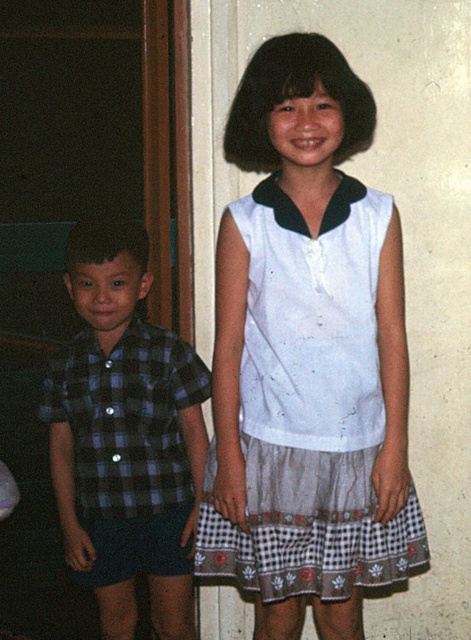
You are a photographer setting up for a photoshoot in the described scene. You need to position a spotlight to the left of the checkered fabric shirt at left. Will the spotlight interfere with the white cotton dress at upper center?

The white cotton dress at upper center is to the right of the checkered fabric shirt at left, so placing the spotlight to the left of the checkered fabric shirt at left would not interfere with the white cotton dress at upper center since it is positioned further to the right.

You are a fashion designer observing two children in the scene. The checkered fabric shirt at left and the plaid fabric shirt at left are both on display. Which shirt has a greater width?

The checkered fabric shirt at left has a greater width than the plaid fabric shirt at left according to the description.

In the scene shown: You are a photographer setting up for a photoshoot in the described scene. You need to place a white cotton dress at upper center in such a way that it doesn not block the wooden door frame on the left. Given the coordinates from the Objects Description, can you confirm if the dress will be positioned safely away from the door frame?

The white cotton dress at upper center is located at point (309, 406), which is away from the wooden door frame on the left, so it will not block the door frame.